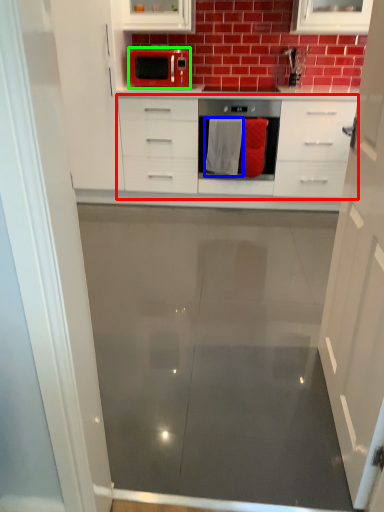
Question: Based on their relative distances, which object is farther from chest of drawers (highlighted by a red box)? Choose from material (highlighted by a blue box) and microwave oven (highlighted by a green box).

Choices:
 (A) material
 (B) microwave oven

Answer: (B)